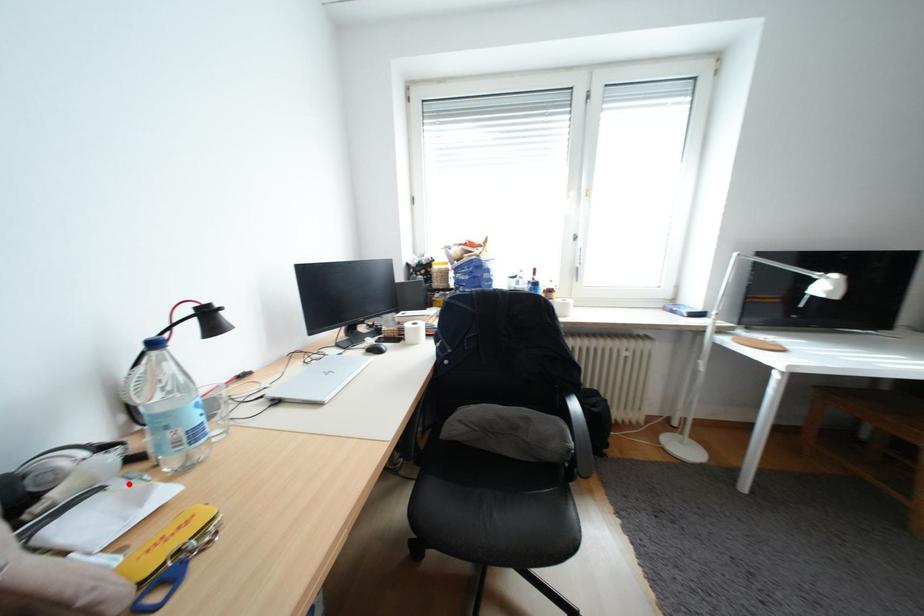
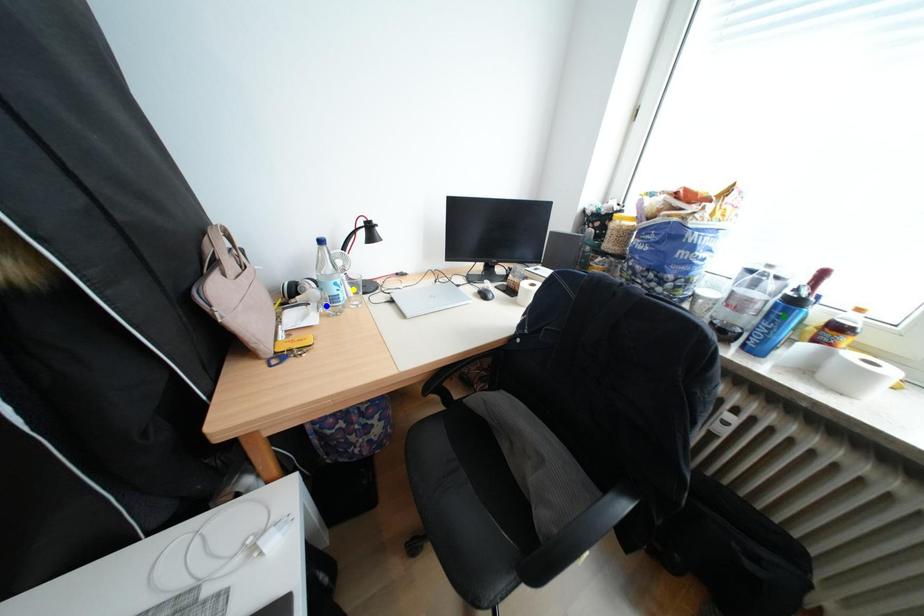
Question: I am providing you with two images of the same scene from different viewpoints. A red point is marked on the first image. You are given multiple points on the second image. Which point in image 2 is actually the same real-world point as the red point in image 1?

Choices:
 (A) green point
 (B) yellow point
 (C) blue point

Answer: (C)